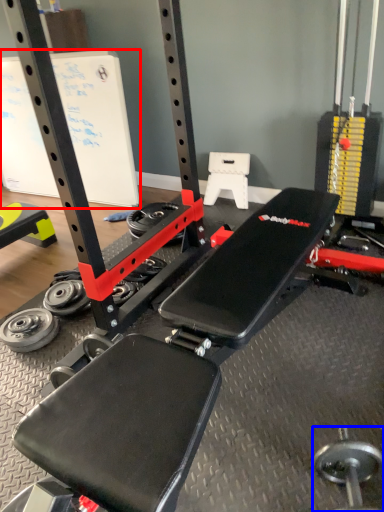
Question: Which object appears farthest to the camera in this image, bulletin board (highlighted by a red box) or dumbbell (highlighted by a blue box)?

Choices:
 (A) bulletin board
 (B) dumbbell

Answer: (A)